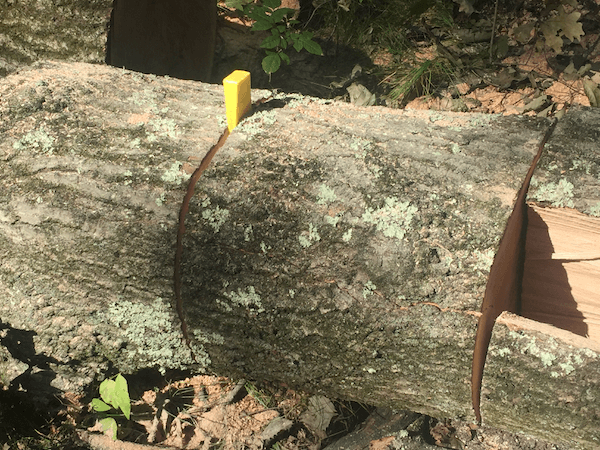
The image size is (600, 450). In order to click on leaves on top-center plant in this screenshot , I will do pyautogui.click(x=276, y=62), pyautogui.click(x=267, y=39), pyautogui.click(x=306, y=41), pyautogui.click(x=265, y=26), pyautogui.click(x=283, y=18), pyautogui.click(x=284, y=40), pyautogui.click(x=285, y=55).